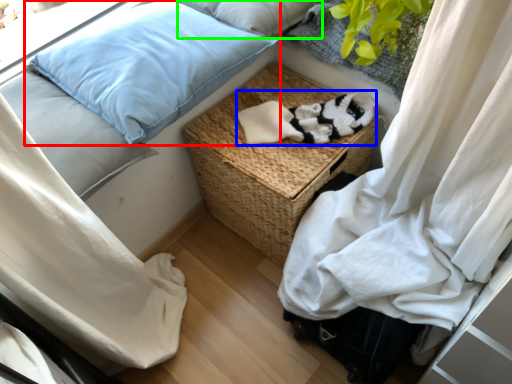
Question: Considering the real-world distances, which object is closest to pillow (highlighted by a red box)? clothing (highlighted by a blue box) or pillow (highlighted by a green box).

Choices:
 (A) clothing
 (B) pillow

Answer: (B)